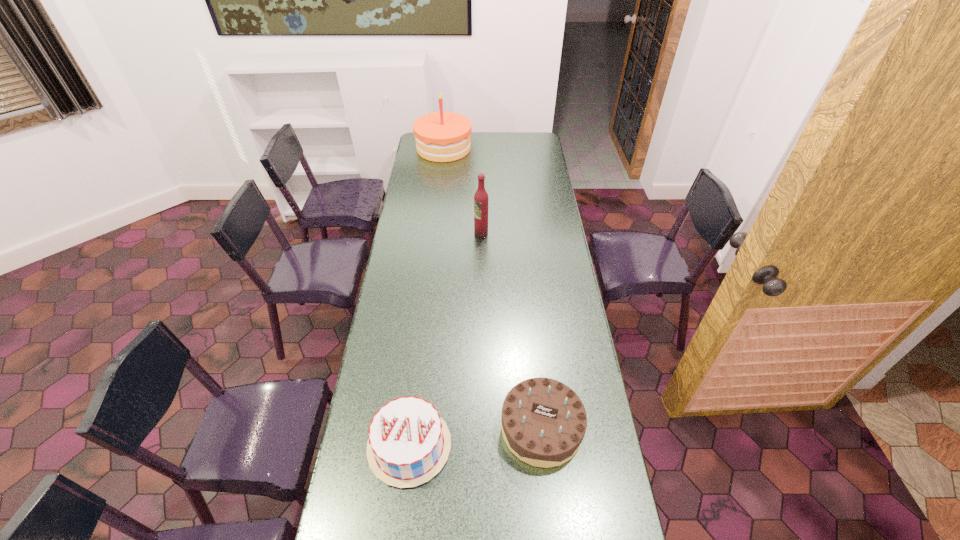
The width and height of the screenshot is (960, 540). What are the coordinates of `the farthest object` in the screenshot? It's located at (441, 136).

What are the coordinates of `the farthest birthday cake` in the screenshot? It's located at (441, 136).

At what (x,y) coordinates should I click in order to perform the action: click on the second object from right to left. Please return your answer as a coordinate pair (x, y). Image resolution: width=960 pixels, height=540 pixels. Looking at the image, I should click on [x=481, y=198].

Where is `the third nearest object`? the third nearest object is located at coordinates (481, 198).

Where is `the rightmost object`? the rightmost object is located at coordinates (543, 422).

Locate an element on the screen. vacant point located on the right of the farthest birthday cake is located at coordinates (481, 148).

This screenshot has height=540, width=960. In order to click on free space located on the label of the third object from left to right in this screenshot , I will do `click(438, 233)`.

Identify the location of vacant space located 0.100m on the label of the third object from left to right. The width and height of the screenshot is (960, 540). [x=453, y=233].

Find the location of a particular element. The height and width of the screenshot is (540, 960). vacant space located on the label of the third object from left to right is located at coordinates (422, 233).

At what (x,y) coordinates should I click in order to perform the action: click on vacant space located 0.070m on the front-facing side of the rightmost birthday cake. Please return your answer as a coordinate pair (x, y). Looking at the image, I should click on (548, 495).